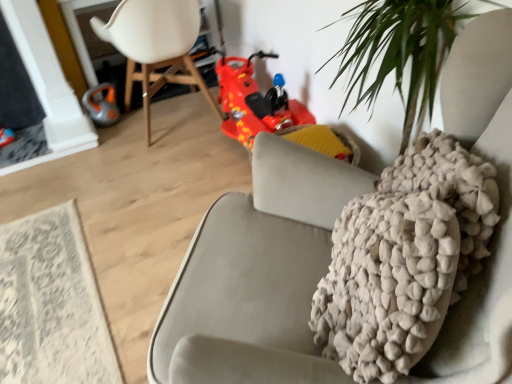
Question: From a real-world perspective, is white plastic chair at upper left over white textured rug at lower left?

Choices:
 (A) no
 (B) yes

Answer: (B)

Question: Does white plastic chair at upper left come in front of white textured rug at lower left?

Choices:
 (A) yes
 (B) no

Answer: (B)

Question: Can you confirm if white plastic chair at upper left is positioned to the right of white textured rug at lower left?

Choices:
 (A) yes
 (B) no

Answer: (A)

Question: Is white plastic chair at upper left oriented towards white textured rug at lower left?

Choices:
 (A) yes
 (B) no

Answer: (B)

Question: Could white textured rug at lower left be considered to be inside white plastic chair at upper left?

Choices:
 (A) yes
 (B) no

Answer: (B)

Question: Is white textured rug at lower left at the back of white plastic chair at upper left?

Choices:
 (A) no
 (B) yes

Answer: (A)

Question: Considering the relative positions of orange rubber vacuum cleaner at left and shiny red plastic toy car at center in the image provided, is orange rubber vacuum cleaner at left to the right of shiny red plastic toy car at center from the viewer's perspective?

Choices:
 (A) no
 (B) yes

Answer: (A)

Question: Is orange rubber vacuum cleaner at left positioned with its back to shiny red plastic toy car at center?

Choices:
 (A) yes
 (B) no

Answer: (B)

Question: Is orange rubber vacuum cleaner at left bigger than shiny red plastic toy car at center?

Choices:
 (A) yes
 (B) no

Answer: (B)

Question: Is orange rubber vacuum cleaner at left wider than shiny red plastic toy car at center?

Choices:
 (A) no
 (B) yes

Answer: (A)

Question: Is the surface of orange rubber vacuum cleaner at left in direct contact with shiny red plastic toy car at center?

Choices:
 (A) yes
 (B) no

Answer: (B)

Question: From the image's perspective, does orange rubber vacuum cleaner at left appear lower than shiny red plastic toy car at center?

Choices:
 (A) no
 (B) yes

Answer: (A)

Question: Is orange rubber vacuum cleaner at left located outside white plastic chair at upper left?

Choices:
 (A) yes
 (B) no

Answer: (A)